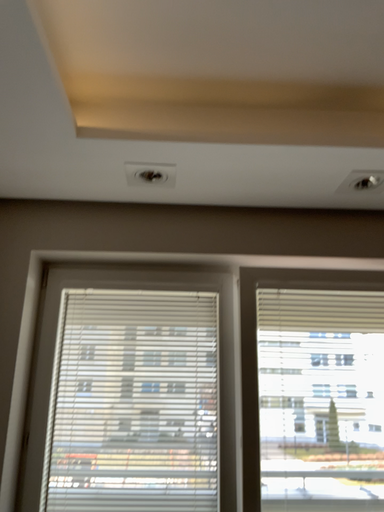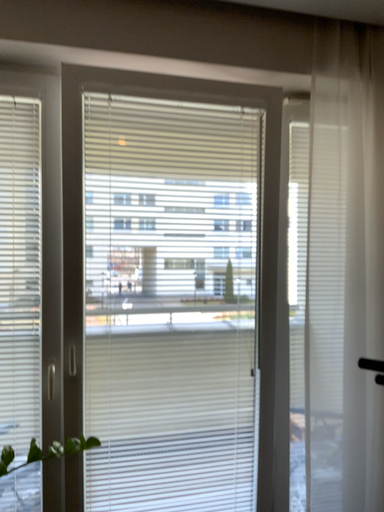
Question: How did the camera likely rotate when shooting the video?

Choices:
 (A) rotated right
 (B) rotated left

Answer: (A)